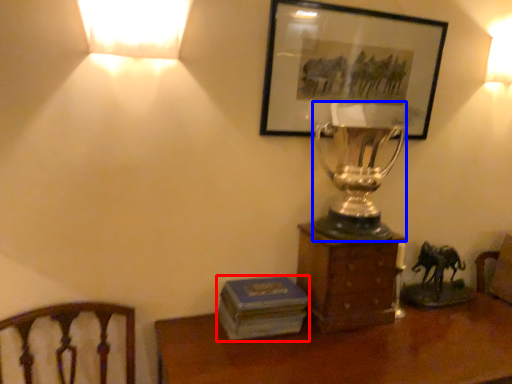
Question: Which object appears farthest to the camera in this image, paperback book (highlighted by a red box) or candle holder (highlighted by a blue box)?

Choices:
 (A) paperback book
 (B) candle holder

Answer: (A)